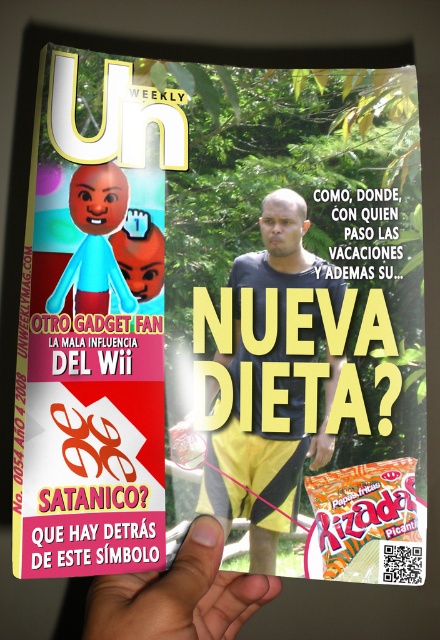
Is light skin tone finger at lower center above orange matte candy at lower right?

Incorrect, light skin tone finger at lower center is not positioned above orange matte candy at lower right.

Which is more to the left, light skin tone finger at lower center or orange matte candy at lower right?

From the viewer's perspective, light skin tone finger at lower center appears more on the left side.

Locate an element on the screen. light skin tone finger at lower center is located at coordinates [179, 595].

Does matte black shirt at center appear on the left side of light skin tone finger at lower center?

In fact, matte black shirt at center is to the right of light skin tone finger at lower center.

Is matte black shirt at center positioned in front of light skin tone finger at lower center?

No, it is not.

This screenshot has width=440, height=640. What do you see at coordinates (272, 381) in the screenshot? I see `matte black shirt at center` at bounding box center [272, 381].

Image resolution: width=440 pixels, height=640 pixels. Identify the location of matte black shirt at center. (272, 381).

Describe the element at coordinates (272, 381) in the screenshot. The width and height of the screenshot is (440, 640). I see `matte black shirt at center` at that location.

Which is below, matte black shirt at center or orange matte candy at lower right?

orange matte candy at lower right is lower down.

Who is more forward, (289, 250) or (374, 500)?

Positioned in front is point (374, 500).

I want to click on matte black shirt at center, so 272,381.